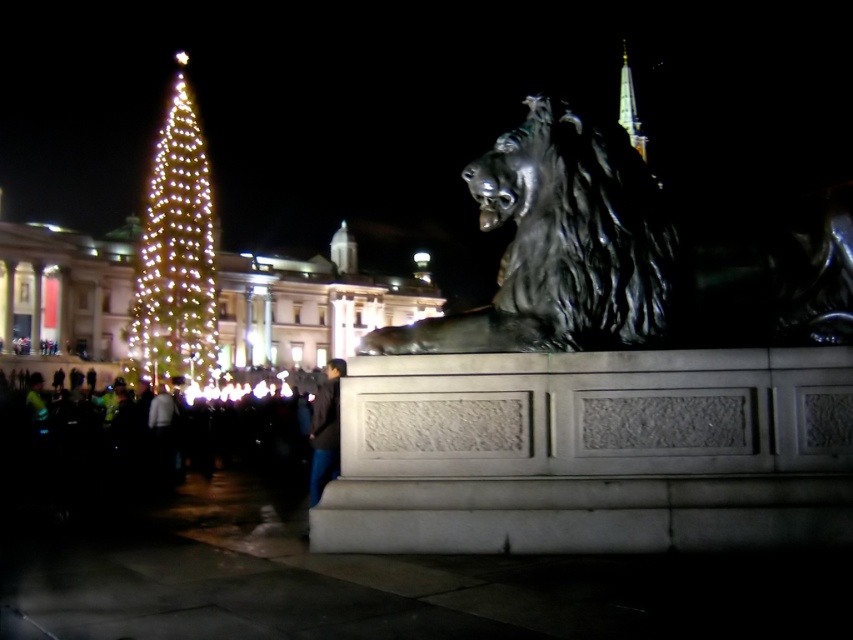
In the scene shown: You are an artist planning to sketch the scene in front of you. You notice the polished bronze lion at center and the dark gray jacket at lower center. Based on their sizes, which object should you draw first to ensure proper scaling when adding the other later?

The polished bronze lion at center is smaller than the dark gray jacket at lower center, so you should draw the dark gray jacket at lower center first to establish the larger scale before adding the smaller lion.

Consider the image. You are a photographer standing in the scene wanting to capture both the polished bronze lion at center and the dark gray jacket at lower center in the same frame. Based on their positions, which object should you adjust your camera to focus on first to ensure both are in the shot?

The polished bronze lion at center is positioned on the right side of dark gray jacket at lower center. To capture both in the same frame, you should focus on the dark gray jacket at lower center first as it is closer to the camera, allowing the lion to naturally fall into the composition on the right side.